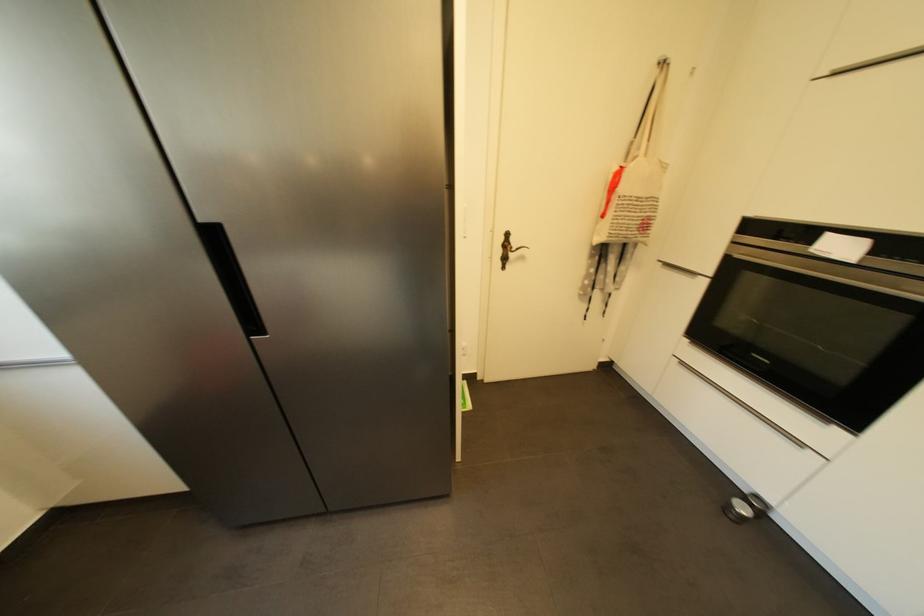
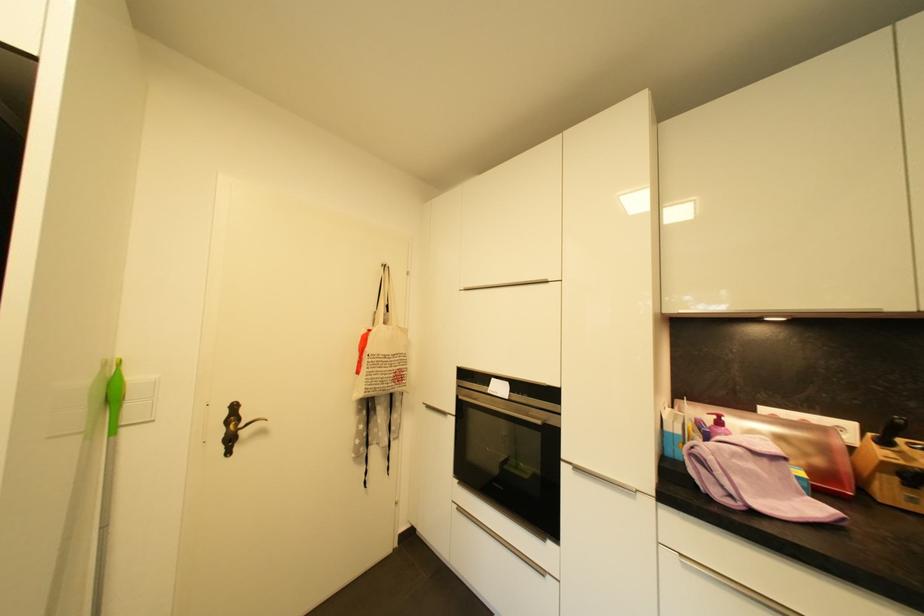
Find the pixel in the second image that matches point 650,228 in the first image.

(405, 379)